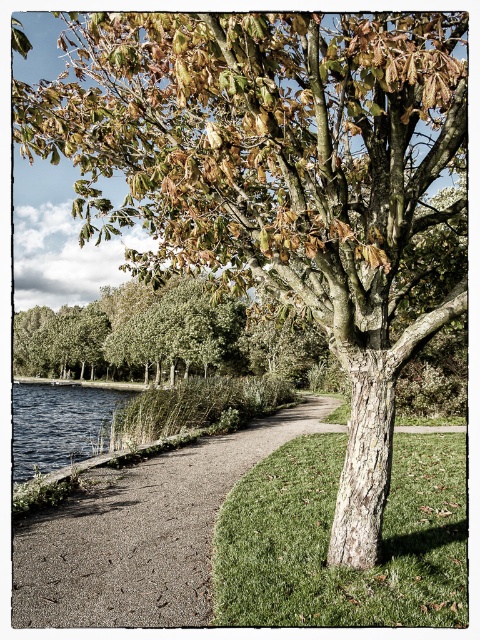
Is gravel path at center closer to the viewer compared to blue water at lower left?

That is True.

Does gravel path at center come behind blue water at lower left?

No, gravel path at center is in front of blue water at lower left.

Between point (282, 436) and point (20, 428), which one is positioned in front?

Point (282, 436) is more forward.

Identify the location of gravel path at center. (143, 532).

Is green grass at center below blue water at lower left?

Incorrect, green grass at center is not positioned below blue water at lower left.

Based on the photo, is green grass at center positioned before blue water at lower left?

Yes, it is.

Locate an element on the screen. green grass at center is located at coordinates tap(328, 536).

Between point (214, 612) and point (76, 516), which one is positioned in front?

Point (214, 612) is in front.

Can you confirm if green grass at center is smaller than gravel path at center?

Indeed, green grass at center has a smaller size compared to gravel path at center.

Which is behind, point (400, 486) or point (132, 548)?

Positioned behind is point (400, 486).

Where is `green grass at center`? The width and height of the screenshot is (480, 640). green grass at center is located at coordinates (328, 536).